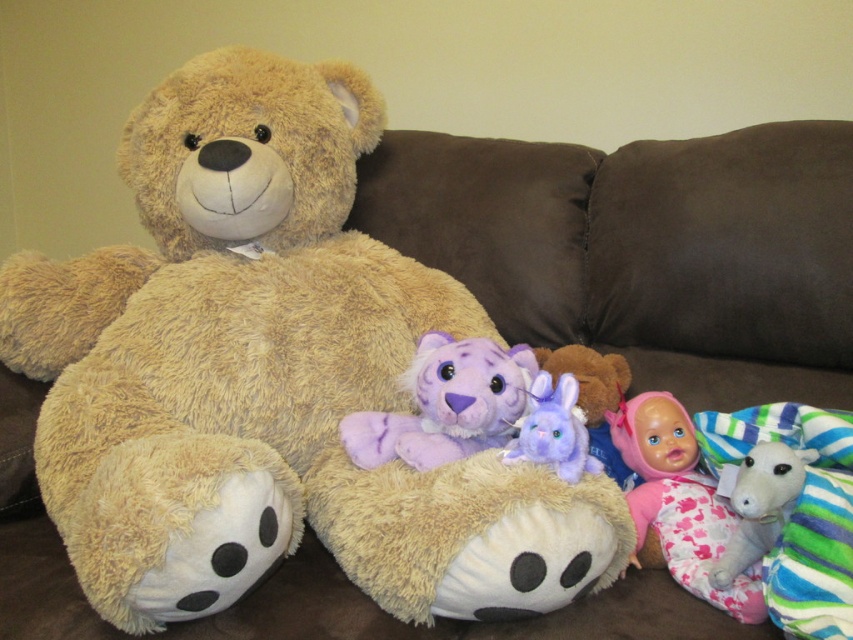
You are organizing a toy shelf and need to place the white plush goat at lower right and the purple plush rabbit at center. If you want to display them vertically in order from tallest to shortest, which one should be placed on top?

The white plush goat at lower right is taller than the purple plush rabbit at center, so it should be placed on top to display them from tallest to shortest.

You are a photographer trying to capture a closeup of the pink fabric doll at lower right. You are currently 1 meter away from the doll. Can you move closer to take the photo without stepping over the 86.95 cm distance mentioned in the scene description?

The distance between the pink fabric doll at lower right and the camera is 86.95 centimeters. Since you are currently 1 meter away, which is 100 centimeters, moving closer to within 86.95 cm would allow you to get closer while staying within the specified distance. Therefore, yes, you can move closer to take the photo without exceeding the 86.95 cm limit.

You are standing in front of the teddy bear and want to pick up the item closest to you. Which point should you reach for, point (x=757, y=602) or point (x=720, y=577)?

Point (x=757, y=602) is closer to the viewer than point (x=720, y=577), so you should reach for point (x=757, y=602).